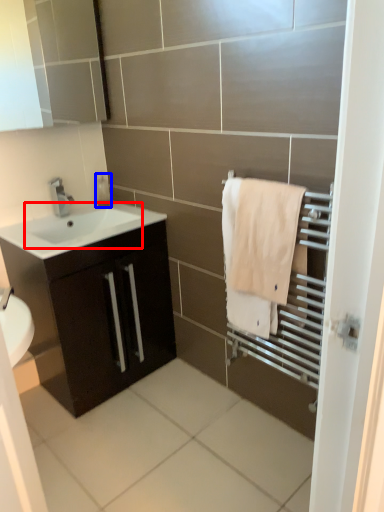
Question: Among these objects, which one is nearest to the camera, sink (highlighted by a red box) or soap dispenser (highlighted by a blue box)?

Choices:
 (A) sink
 (B) soap dispenser

Answer: (A)